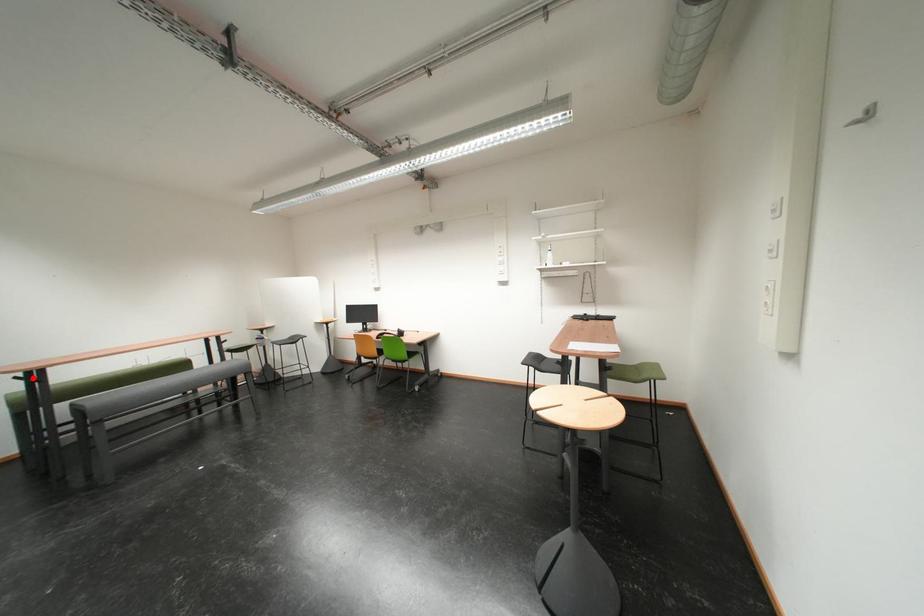
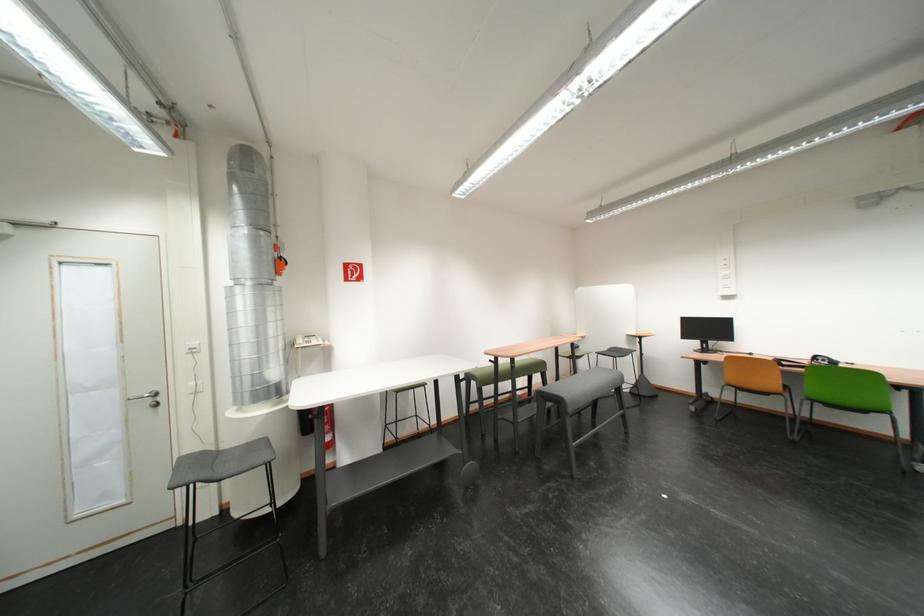
Find the pixel in the second image that matches the highlighted location in the first image.

(505, 362)